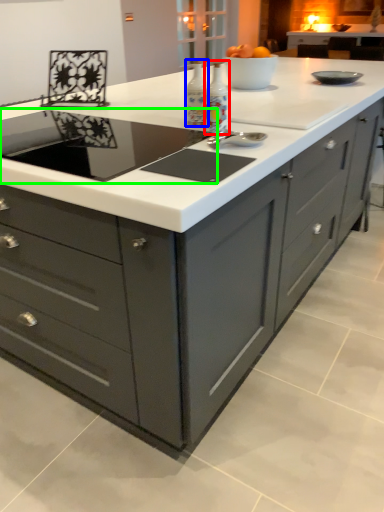
Question: Estimate the real-world distances between objects in this image. Which object is farther from appliance (highlighted by a red box), appliance (highlighted by a blue box) or home appliance (highlighted by a green box)?

Choices:
 (A) appliance
 (B) home appliance

Answer: (B)